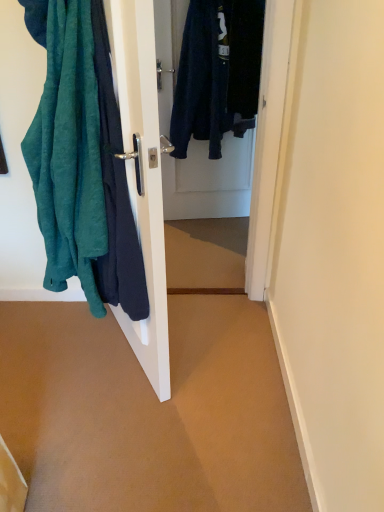
Where is `vacant area that is in front of dark blue fabric door at center`? The height and width of the screenshot is (512, 384). vacant area that is in front of dark blue fabric door at center is located at coordinates (206, 237).